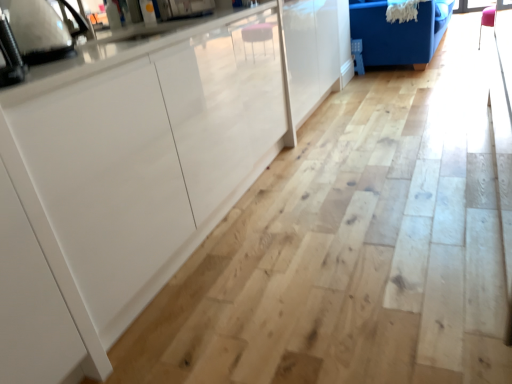
At what (x,y) coordinates should I click in order to perform the action: click on blue fabric couch at upper right. Please return your answer as a coordinate pair (x, y). Looking at the image, I should click on (398, 33).

What do you see at coordinates (398, 33) in the screenshot?
I see `blue fabric couch at upper right` at bounding box center [398, 33].

Measure the distance between blue fabric couch at upper right and camera.

blue fabric couch at upper right and camera are 3.69 meters apart from each other.

Find the location of a particular element. blue fabric couch at upper right is located at coordinates (398, 33).